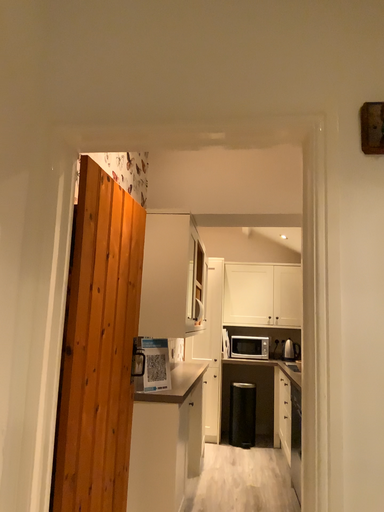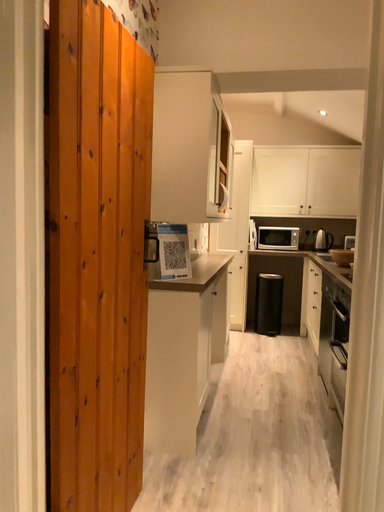
Question: How did the camera likely rotate when shooting the video?

Choices:
 (A) rotated downward
 (B) rotated upward

Answer: (A)